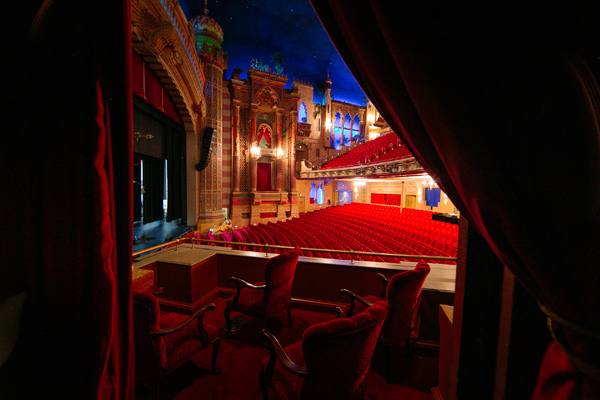
Locate an element on the screen. The height and width of the screenshot is (400, 600). blue ceilling is located at coordinates (308, 38).